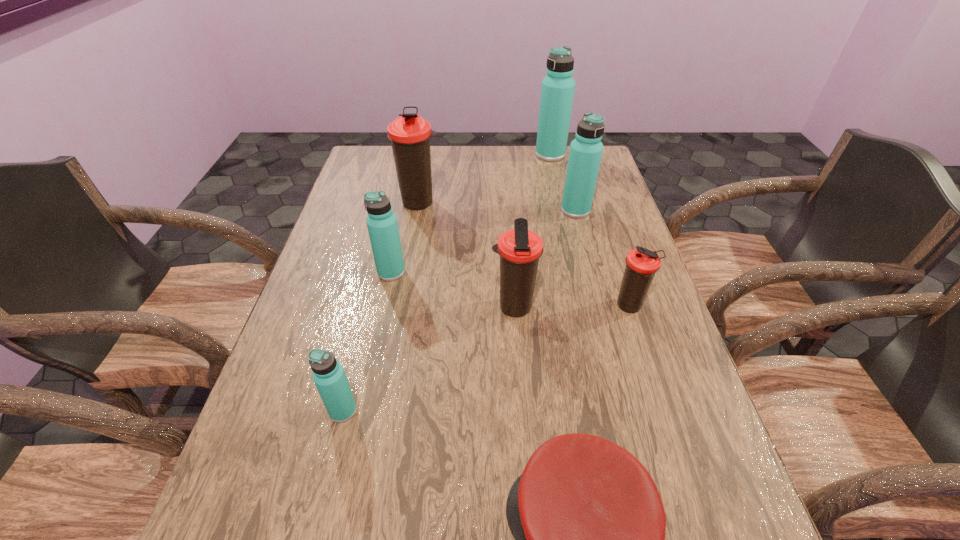
The image size is (960, 540). What are the coordinates of `object positioned at the left edge` in the screenshot? It's located at (328, 375).

Find the location of a particular element. This screenshot has height=540, width=960. object that is at the far right corner is located at coordinates (557, 92).

The width and height of the screenshot is (960, 540). What are the coordinates of `vacant space at the far edge of the desktop` in the screenshot? It's located at tap(434, 163).

Find the location of a particular element. The image size is (960, 540). free space at the left edge of the desktop is located at coordinates [326, 248].

What are the coordinates of `vacant space at the right edge of the desktop` in the screenshot? It's located at (666, 375).

Where is `unoccupied area between the fifth nearest object and the fourth thermos bottle from left to right`? The height and width of the screenshot is (540, 960). unoccupied area between the fifth nearest object and the fourth thermos bottle from left to right is located at coordinates [452, 289].

What are the coordinates of `empty location between the farthest aqua thermos bottle and the second smallest aqua thermos bottle` in the screenshot? It's located at (470, 213).

Find the location of a particular element. The width and height of the screenshot is (960, 540). free spot between the second brown thermos bottle from left to right and the nearest aqua thermos bottle is located at coordinates (428, 359).

Image resolution: width=960 pixels, height=540 pixels. I want to click on vacant area that lies between the second brown thermos bottle from left to right and the second nearest object, so click(428, 359).

Find the location of a particular element. The height and width of the screenshot is (540, 960). free spot between the second brown thermos bottle from left to right and the smallest brown thermos bottle is located at coordinates (x=571, y=307).